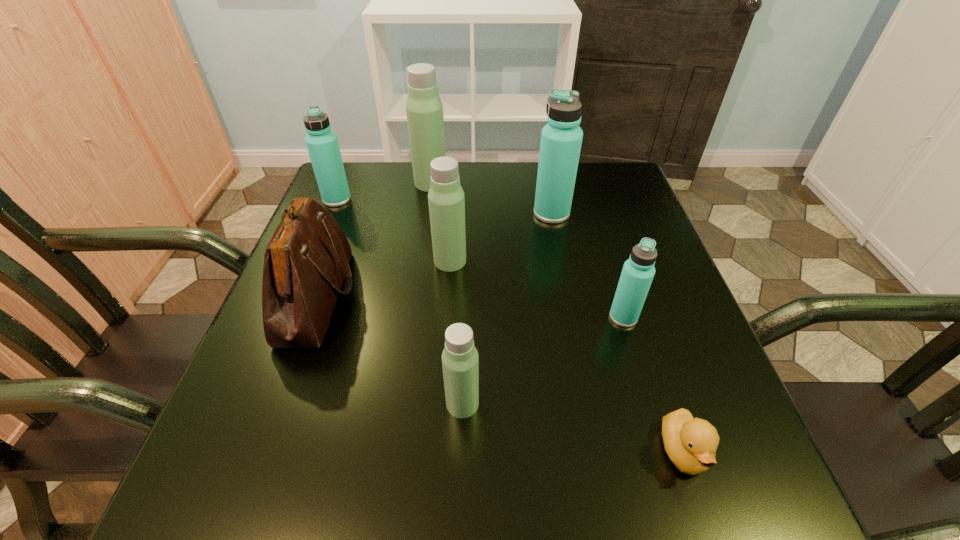
Where is `vacant space located 0.050m on the right of the nearest light thermos bottle`? The height and width of the screenshot is (540, 960). vacant space located 0.050m on the right of the nearest light thermos bottle is located at coordinates (510, 403).

You are a GUI agent. You are given a task and a screenshot of the screen. Output one action in this format:
    pyautogui.click(x=<x>, y=<y>)
    Task: Click on the object that is at the near edge
    The image size is (960, 540).
    Given the screenshot: What is the action you would take?
    pyautogui.click(x=691, y=443)

Image resolution: width=960 pixels, height=540 pixels. In order to click on thermos bottle located in the left edge section of the desktop in this screenshot , I will do `click(322, 144)`.

Where is `shoulder bag that is at the left edge`? This screenshot has height=540, width=960. shoulder bag that is at the left edge is located at coordinates (307, 260).

What are the coordinates of `thermos bottle at the right edge` in the screenshot? It's located at (638, 271).

Where is `duckling that is at the right edge`? This screenshot has width=960, height=540. duckling that is at the right edge is located at coordinates (691, 443).

In order to click on object at the far left corner in this screenshot , I will do `click(322, 144)`.

The image size is (960, 540). Identify the location of object that is positioned at the near right corner. (691, 443).

The height and width of the screenshot is (540, 960). In order to click on free region at the far edge of the desktop in this screenshot , I will do `click(396, 184)`.

Locate an element on the screen. This screenshot has width=960, height=540. free region at the near edge of the desktop is located at coordinates 391,457.